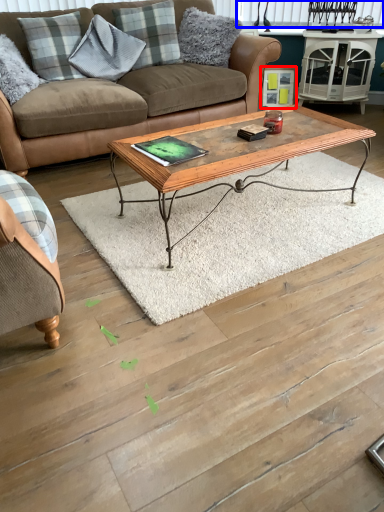
Question: Among these objects, which one is nearest to the camera, picture frame (highlighted by a red box) or window screen (highlighted by a blue box)?

Choices:
 (A) picture frame
 (B) window screen

Answer: (B)